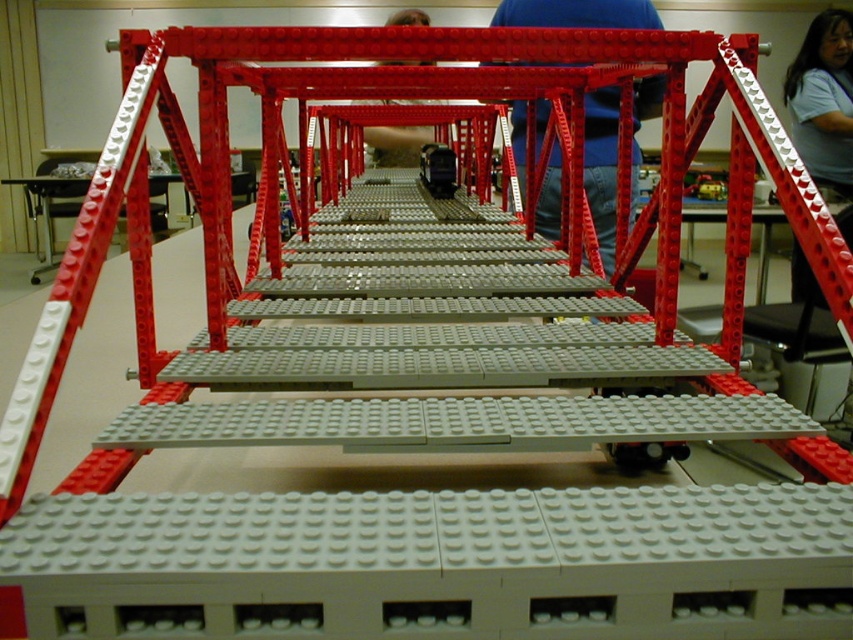
From the picture: You are a photographer trying to capture a clear shot of the matte plastic person at center without the blue fabric shirt at center blocking the view. Is this possible given their positions?

The blue fabric shirt at center is positioned under the matte plastic person at center, so you can capture a clear shot of the matte plastic person at center without the blue fabric shirt at center blocking the view since it is beneath it.

You are a photographer positioned in front of the LEGO bridge model. You notice two figures in the background, the matte gray shirt at upper right and the matte plastic person at center. Which figure is closer to the ground?

The matte gray shirt at upper right is located below the matte plastic person at center, so it is closer to the ground.

You are standing in front of a LEGO bridge model and notice a person wearing a blue fabric shirt at center. If you want to take a photo of them without including the bridge in the background, would you need to move closer or farther away?

The blue fabric shirt at center is 7.23 feet away from the viewer. To exclude the bridge in the background, you would need to move closer to the person wearing the blue fabric shirt at center so that the bridge becomes out of frame behind them.